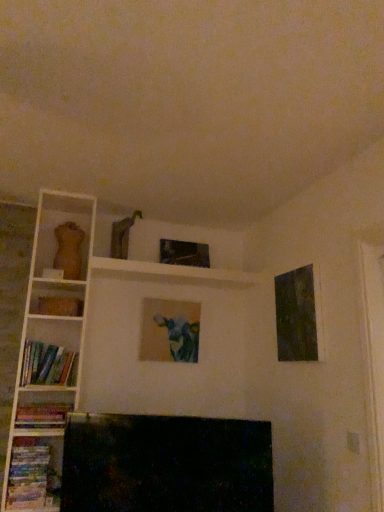
Identify the location of hardcover books at lower left, which appears as the third book when viewed from the top. This screenshot has height=512, width=384. (32, 476).

Describe the element at coordinates (296, 315) in the screenshot. The width and height of the screenshot is (384, 512). I see `dark textured canvas at upper right, the first picture frame when ordered from front to back` at that location.

This screenshot has width=384, height=512. Describe the element at coordinates (60, 306) in the screenshot. I see `hardcover book at left` at that location.

Measure the distance between point (174,308) and camera.

The depth of point (174,308) is 2.97 meters.

Describe the element at coordinates (169, 331) in the screenshot. The width and height of the screenshot is (384, 512). I see `matte canvas painting at center, which appears as the 2th picture frame when viewed from the front` at that location.

The height and width of the screenshot is (512, 384). What do you see at coordinates (48, 365) in the screenshot?
I see `hardcover books at left, the 3th book positioned from the bottom` at bounding box center [48, 365].

Locate an element on the screen. hardcover books at lower left, which appears as the third book when viewed from the top is located at coordinates (32, 476).

Between hardcover books at lower left, which appears as the third book when viewed from the top, and hardcover books at left, the 3th book positioned from the bottom, which one appears on the left side from the viewer's perspective?

Positioned to the left is hardcover books at lower left, which appears as the third book when viewed from the top.

From the image's perspective, would you say hardcover books at lower left, which appears as the third book when viewed from the top, is positioned over hardcover books at left, the 1th book from the top?

No, from the image's perspective, hardcover books at lower left, which appears as the third book when viewed from the top, is not above hardcover books at left, the 1th book from the top.

From a real-world perspective, which object stands above the other?

In real-world perspective, hardcover books at left, the 1th book from the top, is above.

Is hardcover books at left, the 1th book from the top, at the back of hardcover books at lower left, the first book from the bottom?

hardcover books at lower left, the first book from the bottom, is not turned away from hardcover books at left, the 1th book from the top.

Which is more to the left, metallic glass picture frame at upper center, which ranks as the second picture frame in right-to-left order, or matte canvas painting at center, the 3th picture frame in the right-to-left sequence?

From the viewer's perspective, matte canvas painting at center, the 3th picture frame in the right-to-left sequence, appears more on the left side.

Who is bigger, metallic glass picture frame at upper center, the 1th picture frame when ordered from back to front, or matte canvas painting at center, the 3th picture frame in the right-to-left sequence?

matte canvas painting at center, the 3th picture frame in the right-to-left sequence, is bigger.

Would you say metallic glass picture frame at upper center, which ranks as the second picture frame in right-to-left order, contains matte canvas painting at center, the 2th picture frame from the back?

No, matte canvas painting at center, the 2th picture frame from the back, is located outside of metallic glass picture frame at upper center, which ranks as the second picture frame in right-to-left order.

This screenshot has height=512, width=384. Identify the location of picture frame behind the matte canvas painting at center, the 3th picture frame in the right-to-left sequence. 184,253.

Is point (63, 415) behind point (174, 252)?

No, (63, 415) is closer to viewer.

Consider the image. What's the angular difference between hardcover books at left, positioned as the second book in top-to-bottom order, and metallic glass picture frame at upper center, the 1th picture frame when ordered from back to front,'s facing directions?

There is a 0.913-degree angle between the facing directions of hardcover books at left, positioned as the second book in top-to-bottom order, and metallic glass picture frame at upper center, the 1th picture frame when ordered from back to front.

Based on the photo, between hardcover books at left, the second book when ordered from bottom to top, and metallic glass picture frame at upper center, the third picture frame positioned from the front, which one has smaller size?

metallic glass picture frame at upper center, the third picture frame positioned from the front, is smaller.

Is hardcover books at left, positioned as the second book in top-to-bottom order, oriented away from metallic glass picture frame at upper center, the 1th picture frame when ordered from back to front?

No.

Is hardcover books at left, the 3th book positioned from the bottom, surrounding matte canvas painting at center, the 3th picture frame in the right-to-left sequence?

No, matte canvas painting at center, the 3th picture frame in the right-to-left sequence, is not inside hardcover books at left, the 3th book positioned from the bottom.

From a real-world perspective, who is located higher, hardcover books at left, the 3th book positioned from the bottom, or matte canvas painting at center, the 2th picture frame from the back?

matte canvas painting at center, the 2th picture frame from the back, from a real-world perspective.

Where is `book that is the 1st object directly below the matte canvas painting at center, which appears as the 2th picture frame when viewed from the front (from a real-world perspective)`? book that is the 1st object directly below the matte canvas painting at center, which appears as the 2th picture frame when viewed from the front (from a real-world perspective) is located at coordinates (48, 365).

Is hardcover books at left, the 1th book from the top, behind matte canvas painting at center, which appears as the 1th picture frame when viewed from the left?

No.

Is matte canvas painting at center, the 3th picture frame in the right-to-left sequence, far away from hardcover books at left, positioned as the second book in top-to-bottom order?

No, matte canvas painting at center, the 3th picture frame in the right-to-left sequence, is not far away from hardcover books at left, positioned as the second book in top-to-bottom order.

Relative to hardcover books at left, positioned as the second book in top-to-bottom order, is matte canvas painting at center, the 2th picture frame from the back, in front or behind?

matte canvas painting at center, the 2th picture frame from the back, is positioned farther from the viewer than hardcover books at left, positioned as the second book in top-to-bottom order.

How different are the orientations of matte canvas painting at center, the 2th picture frame from the back, and hardcover books at left, the second book when ordered from bottom to top, in degrees?

They differ by 0.914 degrees in their facing directions.

Considering the sizes of objects matte canvas painting at center, which appears as the 1th picture frame when viewed from the left, and hardcover books at left, positioned as the second book in top-to-bottom order, in the image provided, who is thinner, matte canvas painting at center, which appears as the 1th picture frame when viewed from the left, or hardcover books at left, positioned as the second book in top-to-bottom order,?

matte canvas painting at center, which appears as the 1th picture frame when viewed from the left, is thinner.

Is hardcover book at left positioned with its back to hardcover books at lower left, which appears as the third book when viewed from the top?

No, hardcover book at left's orientation is not away from hardcover books at lower left, which appears as the third book when viewed from the top.

Would you say hardcover book at left contains hardcover books at lower left, which appears as the third book when viewed from the top?

Actually, hardcover books at lower left, which appears as the third book when viewed from the top, is outside hardcover book at left.

Considering the relative positions of hardcover book at left and hardcover books at lower left, which appears as the third book when viewed from the top, in the image provided, is hardcover book at left to the right of hardcover books at lower left, which appears as the third book when viewed from the top, from the viewer's perspective?

Yes, hardcover book at left is to the right of hardcover books at lower left, which appears as the third book when viewed from the top.

Considering the relative sizes of hardcover book at left and hardcover books at lower left, which appears as the third book when viewed from the top, in the image provided, is hardcover book at left bigger than hardcover books at lower left, which appears as the third book when viewed from the top,?

No.

Where is `book that is the 3rd one when counting forward from the matte canvas painting at center, which appears as the 2th picture frame when viewed from the front`? book that is the 3rd one when counting forward from the matte canvas painting at center, which appears as the 2th picture frame when viewed from the front is located at coordinates (32, 476).

From the image's perspective, which object appears higher, matte canvas painting at center, which appears as the 2th picture frame when viewed from the front, or hardcover books at lower left, the first book from the bottom?

matte canvas painting at center, which appears as the 2th picture frame when viewed from the front.

Can you confirm if matte canvas painting at center, the 3th picture frame in the right-to-left sequence, is wider than hardcover books at lower left, which appears as the third book when viewed from the top?

No, matte canvas painting at center, the 3th picture frame in the right-to-left sequence, is not wider than hardcover books at lower left, which appears as the third book when viewed from the top.

Based on the photo, is matte canvas painting at center, which appears as the 2th picture frame when viewed from the front, with hardcover books at lower left, which appears as the third book when viewed from the top?

They are not placed beside each other.

Where is `the 2nd book positioned below the hardcover books at left, the 3th book positioned from the bottom (from a real-world perspective)`? This screenshot has width=384, height=512. the 2nd book positioned below the hardcover books at left, the 3th book positioned from the bottom (from a real-world perspective) is located at coordinates (32, 476).

There is a matte canvas painting at center, the 3th picture frame in the right-to-left sequence. In order to click on the 2nd picture frame above it (from the image's perspective) in this screenshot , I will do `click(184, 253)`.

From the image, which object appears to be farther from hardcover book at left, metallic glass picture frame at upper center, the 1th picture frame when ordered from back to front, or hardcover books at lower left, the first book from the bottom?

hardcover books at lower left, the first book from the bottom, is positioned further to the anchor hardcover book at left.

From the image, which object appears to be farther from metallic glass picture frame at upper center, the 1th picture frame when ordered from back to front, hardcover books at lower left, the first book from the bottom, or matte canvas painting at center, which appears as the 1th picture frame when viewed from the left?

hardcover books at lower left, the first book from the bottom.

Looking at the image, which one is located further to hardcover book at left, hardcover books at lower left, which appears as the third book when viewed from the top, or metallic glass picture frame at upper center, which is the 2th picture frame from left to right?

hardcover books at lower left, which appears as the third book when viewed from the top, is positioned further to the anchor hardcover book at left.

Which object lies nearer to the anchor point metallic glass picture frame at upper center, which is the 2th picture frame from left to right, hardcover books at left, the second book when ordered from bottom to top, or hardcover books at lower left, the first book from the bottom?

hardcover books at left, the second book when ordered from bottom to top, is closer to metallic glass picture frame at upper center, which is the 2th picture frame from left to right.

From the image, which object appears to be nearer to hardcover books at left, the 3th book positioned from the bottom, dark textured canvas at upper right, the first picture frame viewed from the right, or metallic glass picture frame at upper center, which ranks as the second picture frame in right-to-left order?

metallic glass picture frame at upper center, which ranks as the second picture frame in right-to-left order, is positioned closer to the anchor hardcover books at left, the 3th book positioned from the bottom.

Which object lies further to the anchor point hardcover books at left, the second book when ordered from bottom to top, metallic glass picture frame at upper center, the third picture frame positioned from the front, or hardcover books at lower left, which appears as the third book when viewed from the top?

The object further to hardcover books at left, the second book when ordered from bottom to top, is metallic glass picture frame at upper center, the third picture frame positioned from the front.

From the image, which object appears to be farther from matte canvas painting at center, which appears as the 1th picture frame when viewed from the left, hardcover books at left, positioned as the second book in top-to-bottom order, or dark textured canvas at upper right, acting as the third picture frame starting from the left?

dark textured canvas at upper right, acting as the third picture frame starting from the left, is positioned further to the anchor matte canvas painting at center, which appears as the 1th picture frame when viewed from the left.

When comparing their distances from metallic glass picture frame at upper center, the third picture frame positioned from the front, does hardcover books at left, positioned as the second book in top-to-bottom order, or matte canvas painting at center, the 3th picture frame in the right-to-left sequence, seem further?

The object further to metallic glass picture frame at upper center, the third picture frame positioned from the front, is hardcover books at left, positioned as the second book in top-to-bottom order.

Image resolution: width=384 pixels, height=512 pixels. I want to click on paperback book between hardcover books at left, the 1th book from the top, and matte canvas painting at center, the 2th picture frame from the back, in the horizontal direction, so click(x=60, y=306).

Find the location of a particular element. This screenshot has width=384, height=512. paperback book between hardcover books at left, positioned as the second book in top-to-bottom order, and dark textured canvas at upper right, acting as the third picture frame starting from the left, from left to right is located at coordinates (60, 306).

The image size is (384, 512). Find the location of `book between hardcover book at left and hardcover books at left, the second book when ordered from bottom to top, vertically`. book between hardcover book at left and hardcover books at left, the second book when ordered from bottom to top, vertically is located at coordinates (48, 365).

Image resolution: width=384 pixels, height=512 pixels. What are the coordinates of `picture frame located between hardcover books at left, the 3th book positioned from the bottom, and metallic glass picture frame at upper center, the 1th picture frame when ordered from back to front, in the left-right direction` in the screenshot? It's located at (169, 331).